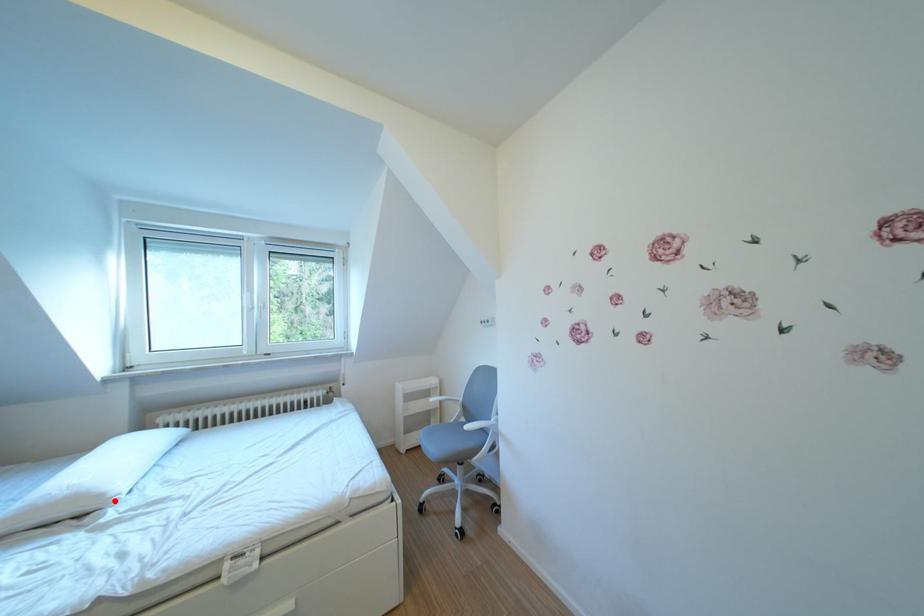
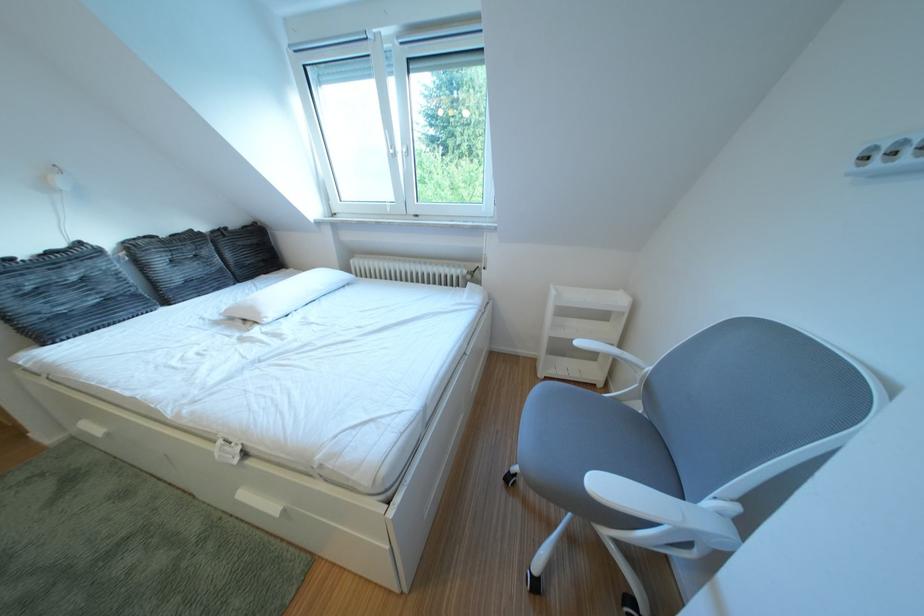
The point at the highlighted location is marked in the first image. Where is the corresponding point in the second image?

(273, 318)